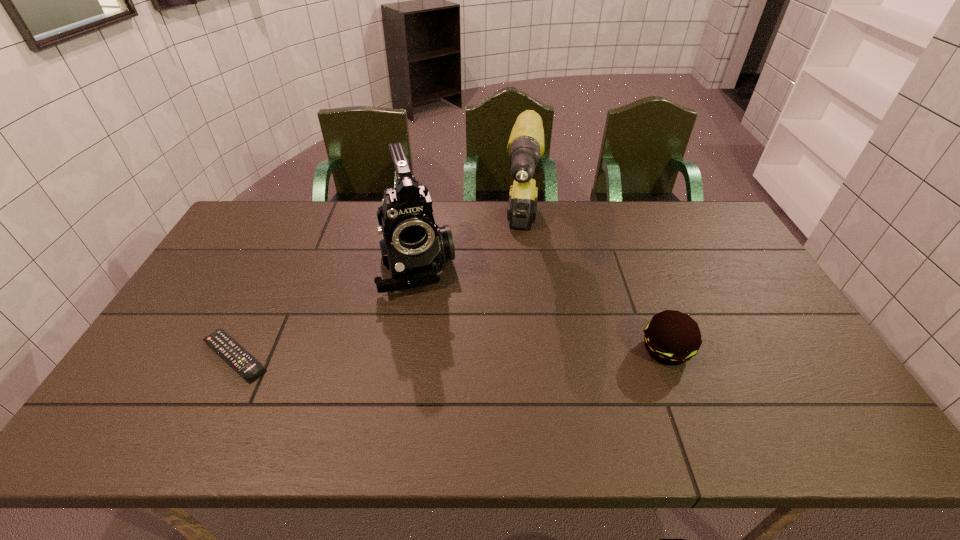
Identify the location of vacant position located 0.200m on the lens mount of the third object from right to left. This screenshot has height=540, width=960. (439, 352).

Identify the location of vacant space located on the handle side of the drill. This screenshot has width=960, height=540. click(522, 284).

The height and width of the screenshot is (540, 960). What are the coordinates of `blank space located 0.230m on the handle side of the drill` in the screenshot? It's located at (517, 329).

Locate an element on the screen. vacant space located on the handle side of the drill is located at coordinates (519, 313).

You are a GUI agent. You are given a task and a screenshot of the screen. Output one action in this format:
    pyautogui.click(x=<x>, y=<y>)
    Task: Click on the camcorder located at the far edge
    The height and width of the screenshot is (540, 960).
    Given the screenshot: What is the action you would take?
    pyautogui.click(x=414, y=248)

At what (x,y) coordinates should I click in order to perform the action: click on drill at the far edge. Please return your answer as a coordinate pair (x, y). Looking at the image, I should click on (526, 143).

Locate an element on the screen. Image resolution: width=960 pixels, height=540 pixels. remote control located at the near edge is located at coordinates (225, 346).

Locate an element on the screen. patty located at the near edge is located at coordinates (671, 337).

The height and width of the screenshot is (540, 960). In order to click on object that is at the left edge in this screenshot , I will do point(225,346).

Where is `object that is at the near left corner`? object that is at the near left corner is located at coordinates (225, 346).